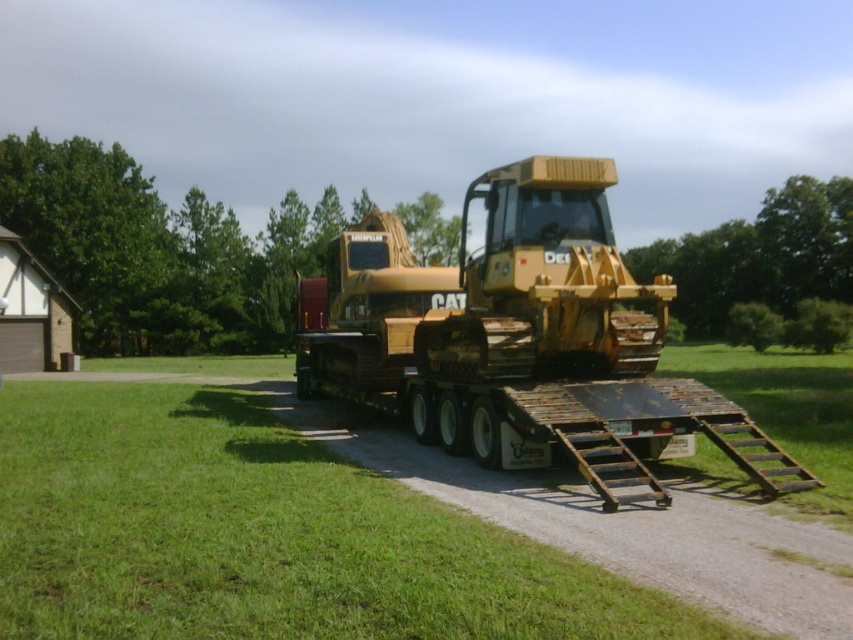
Who is taller, green grass at lower left or yellow metallic tractor at center?

yellow metallic tractor at center is taller.

Where is `green grass at lower left`? The height and width of the screenshot is (640, 853). green grass at lower left is located at coordinates (263, 536).

Between point (13, 477) and point (561, 307), which one is positioned behind?

Point (561, 307)

Find the location of a particular element. This screenshot has height=640, width=853. green grass at lower left is located at coordinates (263, 536).